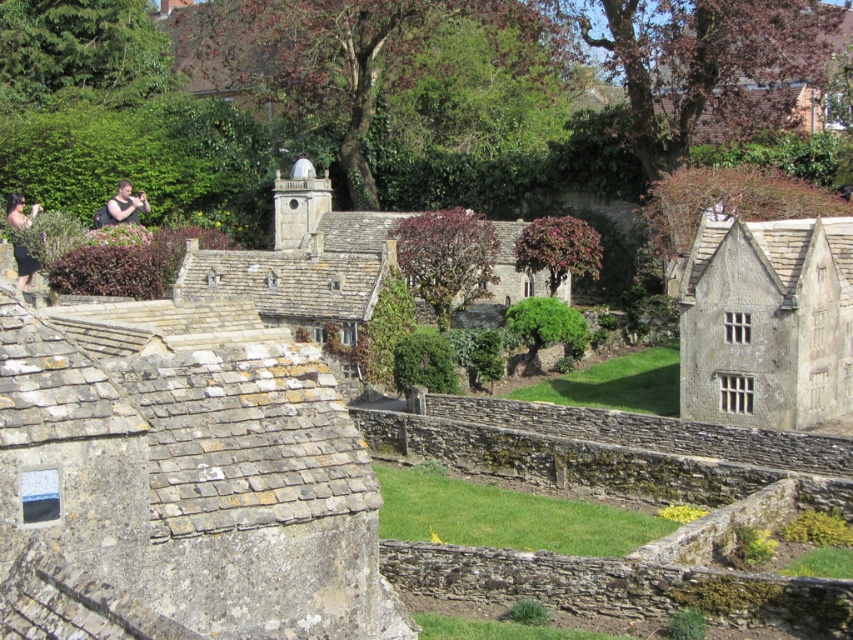
Is matte black dress at left above matte black shirt at upper left?

No, matte black dress at left is not above matte black shirt at upper left.

Is matte black dress at left positioned at the back of matte black shirt at upper left?

No.

The width and height of the screenshot is (853, 640). Find the location of `matte black dress at left`. matte black dress at left is located at coordinates (19, 211).